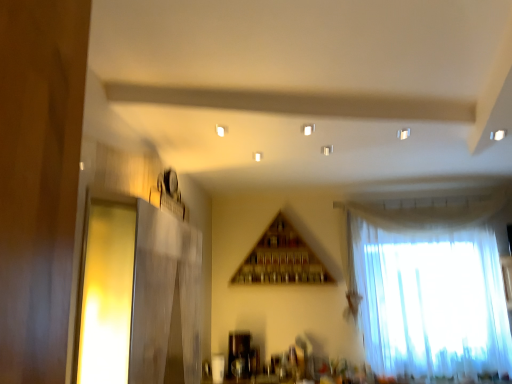
What do you see at coordinates (431, 300) in the screenshot? This screenshot has height=384, width=512. I see `white sheer curtain at right` at bounding box center [431, 300].

Image resolution: width=512 pixels, height=384 pixels. Find the location of `white sheer curtain at right`. white sheer curtain at right is located at coordinates (431, 300).

Measure the distance between point (89,275) and camera.

Point (89,275) is 1.56 meters away from camera.

Image resolution: width=512 pixels, height=384 pixels. Describe the element at coordinates (105, 293) in the screenshot. I see `translucent glass window at left` at that location.

I want to click on translucent glass window at left, so click(105, 293).

This screenshot has width=512, height=384. I want to click on white sheer curtain at right, so click(x=431, y=300).

Is white sheer curtain at right at the right side of translucent glass window at left?

Yes.

Considering the positions of objects white sheer curtain at right and translucent glass window at left in the image provided, who is behind, white sheer curtain at right or translucent glass window at left?

white sheer curtain at right.

Is point (453, 300) closer to camera compared to point (126, 375)?

No, it is behind (126, 375).

From the image's perspective, is white sheer curtain at right below translucent glass window at left?

Yes.

From a real-world perspective, is white sheer curtain at right positioned above or below translucent glass window at left?

In terms of real-world spatial position, white sheer curtain at right is above translucent glass window at left.

In terms of width, does white sheer curtain at right look wider or thinner when compared to translucent glass window at left?

white sheer curtain at right is wider than translucent glass window at left.

Does white sheer curtain at right have a lesser height compared to translucent glass window at left?

No.

Does white sheer curtain at right have a larger size compared to translucent glass window at left?

Correct, white sheer curtain at right is larger in size than translucent glass window at left.

Is white sheer curtain at right not inside translucent glass window at left?

That's correct, white sheer curtain at right is outside of translucent glass window at left.

Is white sheer curtain at right positioned far away from translucent glass window at left?

white sheer curtain at right is far away from translucent glass window at left.

Is white sheer curtain at right looking in the opposite direction of translucent glass window at left?

No, white sheer curtain at right is not facing away from translucent glass window at left.

How much distance is there between white sheer curtain at right and translucent glass window at left?

white sheer curtain at right is 2.80 meters from translucent glass window at left.

At what (x,y) coordinates should I click in order to perform the action: click on curtain behind the translucent glass window at left. Please return your answer as a coordinate pair (x, y). Image resolution: width=512 pixels, height=384 pixels. Looking at the image, I should click on (431, 300).

Considering the relative positions of translucent glass window at left and white sheer curtain at right in the image provided, is translucent glass window at left to the left or to the right of white sheer curtain at right?

translucent glass window at left is positioned on white sheer curtain at right's left side.

Does translucent glass window at left come in front of white sheer curtain at right?

Yes, it is.

Which is in front, point (99, 223) or point (448, 236)?

The point (99, 223) is in front.

From the image's perspective, which one is positioned lower, translucent glass window at left or white sheer curtain at right?

white sheer curtain at right is shown below in the image.

From a real-world perspective, is translucent glass window at left on top of white sheer curtain at right?

No, from a real-world perspective, translucent glass window at left is not over white sheer curtain at right

Can you confirm if translucent glass window at left is thinner than white sheer curtain at right?

Indeed, translucent glass window at left has a lesser width compared to white sheer curtain at right.

Considering the sizes of objects translucent glass window at left and white sheer curtain at right in the image provided, who is shorter, translucent glass window at left or white sheer curtain at right?

translucent glass window at left is shorter.

Does translucent glass window at left have a larger size compared to white sheer curtain at right?

No, translucent glass window at left is not bigger than white sheer curtain at right.

Is translucent glass window at left located outside white sheer curtain at right?

Yes, translucent glass window at left is located beyond the bounds of white sheer curtain at right.

Is translucent glass window at left not close to white sheer curtain at right?

Indeed, translucent glass window at left is not near white sheer curtain at right.

Could you tell me if translucent glass window at left is turned towards white sheer curtain at right?

No, translucent glass window at left is not oriented towards white sheer curtain at right.

Measure the distance from translucent glass window at left to white sheer curtain at right.

2.80 meters.

You are a GUI agent. You are given a task and a screenshot of the screen. Output one action in this format:
    pyautogui.click(x=<x>, y=<y>)
    Task: Click on the window below the white sheer curtain at right (from a real-world perspective)
    This screenshot has height=384, width=512.
    Given the screenshot: What is the action you would take?
    pyautogui.click(x=105, y=293)

The image size is (512, 384). Find the location of `window above the white sheer curtain at right (from the image's perspective)`. window above the white sheer curtain at right (from the image's perspective) is located at coordinates (105, 293).

Locate an element on the screen. The height and width of the screenshot is (384, 512). curtain below the translucent glass window at left (from the image's perspective) is located at coordinates (431, 300).